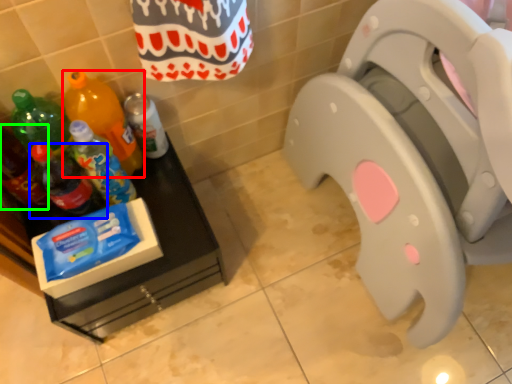
Question: Estimate the real-world distances between objects in this image. Which object is farther from bottle (highlighted by a red box), bottle (highlighted by a blue box) or bottle (highlighted by a green box)?

Choices:
 (A) bottle
 (B) bottle

Answer: (B)